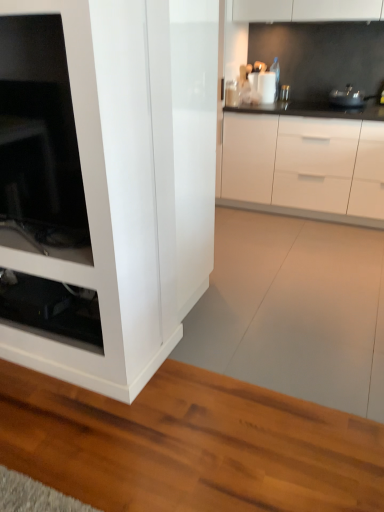
I want to click on white glossy container at upper center, arranged as the 2th appliance when viewed from the right, so click(x=262, y=87).

Where is `transparent glass shelf at lower left`? This screenshot has height=512, width=384. transparent glass shelf at lower left is located at coordinates (51, 309).

You are a GUI agent. You are given a task and a screenshot of the screen. Output one action in this format:
    pyautogui.click(x=<x>, y=<y>)
    Task: Click on the metallic silver pot at upper right, the 1th appliance viewed from the right
    The width and height of the screenshot is (384, 512).
    Given the screenshot: What is the action you would take?
    pyautogui.click(x=348, y=97)

Can you see white glossy container at upper center, arranged as the 2th appliance when viewed from the right, touching white glossy cabinet at center?

No, white glossy container at upper center, arranged as the 2th appliance when viewed from the right, is not touching white glossy cabinet at center.

Considering the relative sizes of white glossy container at upper center, arranged as the 2th appliance when viewed from the right, and white glossy cabinet at center in the image provided, is white glossy container at upper center, arranged as the 2th appliance when viewed from the right, thinner than white glossy cabinet at center?

Indeed, white glossy container at upper center, arranged as the 2th appliance when viewed from the right, has a lesser width compared to white glossy cabinet at center.

From the image's perspective, is white glossy container at upper center, arranged as the 2th appliance when viewed from the right, above white glossy cabinet at center?

Indeed, from the image's perspective, white glossy container at upper center, arranged as the 2th appliance when viewed from the right, is shown above white glossy cabinet at center.

Which is farther, (260, 96) or (310, 213)?

The point (260, 96) is farther.

Would you say metallic silver pot at upper right, the 1th appliance viewed from the right, is outside white glossy cabinet at center?

Yes.

The width and height of the screenshot is (384, 512). In order to click on the 1st appliance directly above the white glossy cabinet at center (from a real-world perspective) in this screenshot , I will do `click(348, 97)`.

Is white glossy cabinet at center at the back of metallic silver pot at upper right, which is the 2th appliance in left-to-right order?

metallic silver pot at upper right, which is the 2th appliance in left-to-right order, does not have its back to white glossy cabinet at center.

Which of these two, metallic silver pot at upper right, the 1th appliance viewed from the right, or white glossy cabinet at center, stands taller?

white glossy cabinet at center is taller.

Is transparent glass shelf at lower left far from white glossy container at upper center, marked as the first appliance in a left-to-right arrangement?

Absolutely, transparent glass shelf at lower left is distant from white glossy container at upper center, marked as the first appliance in a left-to-right arrangement.

In the scene shown: How different are the orientations of transparent glass shelf at lower left and white glossy container at upper center, arranged as the 2th appliance when viewed from the right, in degrees?

1.92 degrees.

Is transparent glass shelf at lower left aimed at white glossy container at upper center, arranged as the 2th appliance when viewed from the right?

No, transparent glass shelf at lower left is not turned towards white glossy container at upper center, arranged as the 2th appliance when viewed from the right.

Who is more distant, transparent glass shelf at lower left or white glossy container at upper center, marked as the first appliance in a left-to-right arrangement?

white glossy container at upper center, marked as the first appliance in a left-to-right arrangement, is further from the camera.

From a real-world perspective, does white glossy cabinet at center sit lower than transparent glass shelf at lower left?

No, from a real-world perspective, white glossy cabinet at center is not under transparent glass shelf at lower left.

Which of these two, white glossy cabinet at center or transparent glass shelf at lower left, is bigger?

white glossy cabinet at center is bigger.

Is white glossy cabinet at center in front of or behind transparent glass shelf at lower left in the image?

white glossy cabinet at center is positioned farther from the viewer than transparent glass shelf at lower left.

Is white glossy cabinet at center not inside transparent glass shelf at lower left?

Yes, white glossy cabinet at center is outside of transparent glass shelf at lower left.

Considering the relative sizes of transparent glass shelf at lower left and metallic silver pot at upper right, the 1th appliance viewed from the right, in the image provided, is transparent glass shelf at lower left wider than metallic silver pot at upper right, the 1th appliance viewed from the right,?

No.

How much distance is there between transparent glass shelf at lower left and metallic silver pot at upper right, the 1th appliance viewed from the right?

The distance of transparent glass shelf at lower left from metallic silver pot at upper right, the 1th appliance viewed from the right, is 2.67 meters.

In the scene shown: From the image's perspective, is transparent glass shelf at lower left beneath metallic silver pot at upper right, the 1th appliance viewed from the right?

Yes, from the image's perspective, transparent glass shelf at lower left is beneath metallic silver pot at upper right, the 1th appliance viewed from the right.

Is point (32, 298) less distant than point (350, 84)?

Yes, point (32, 298) is in front of point (350, 84).

In terms of width, does white glossy container at upper center, marked as the first appliance in a left-to-right arrangement, look wider or thinner when compared to metallic silver pot at upper right, which is the 2th appliance in left-to-right order?

In the image, white glossy container at upper center, marked as the first appliance in a left-to-right arrangement, appears to be more narrow than metallic silver pot at upper right, which is the 2th appliance in left-to-right order.

Consider the image. From the image's perspective, does white glossy container at upper center, marked as the first appliance in a left-to-right arrangement, appear lower than metallic silver pot at upper right, the 1th appliance viewed from the right?

No.

Based on the photo, could metallic silver pot at upper right, the 1th appliance viewed from the right, be considered to be inside white glossy container at upper center, arranged as the 2th appliance when viewed from the right?

That's incorrect, metallic silver pot at upper right, the 1th appliance viewed from the right, is not inside white glossy container at upper center, arranged as the 2th appliance when viewed from the right.

Who is smaller, white glossy cabinet at center or white glossy container at upper center, arranged as the 2th appliance when viewed from the right?

Smaller between the two is white glossy container at upper center, arranged as the 2th appliance when viewed from the right.

Identify the location of cabinetry on the right of white glossy container at upper center, arranged as the 2th appliance when viewed from the right. The width and height of the screenshot is (384, 512). (305, 161).

Is white glossy cabinet at center situated inside white glossy container at upper center, marked as the first appliance in a left-to-right arrangement, or outside?

white glossy cabinet at center is outside white glossy container at upper center, marked as the first appliance in a left-to-right arrangement.

Considering the sizes of objects white glossy cabinet at center and white glossy container at upper center, arranged as the 2th appliance when viewed from the right, in the image provided, who is taller, white glossy cabinet at center or white glossy container at upper center, arranged as the 2th appliance when viewed from the right,?

With more height is white glossy cabinet at center.

This screenshot has width=384, height=512. Identify the location of cabinetry that appears below the white glossy container at upper center, marked as the first appliance in a left-to-right arrangement (from the image's perspective). (305, 161).

Where is `cabinetry beneath the metallic silver pot at upper right, the 1th appliance viewed from the right (from a real-world perspective)`? This screenshot has height=512, width=384. cabinetry beneath the metallic silver pot at upper right, the 1th appliance viewed from the right (from a real-world perspective) is located at coordinates (305, 161).

When comparing their distances from transparent glass shelf at lower left, does metallic silver pot at upper right, which is the 2th appliance in left-to-right order, or white glossy cabinet at center seem further?

metallic silver pot at upper right, which is the 2th appliance in left-to-right order, is positioned further to the anchor transparent glass shelf at lower left.

Which object lies nearer to the anchor point transparent glass shelf at lower left, metallic silver pot at upper right, which is the 2th appliance in left-to-right order, or white glossy container at upper center, arranged as the 2th appliance when viewed from the right?

The object closer to transparent glass shelf at lower left is white glossy container at upper center, arranged as the 2th appliance when viewed from the right.

From the image, which object appears to be farther from white glossy cabinet at center, white glossy container at upper center, arranged as the 2th appliance when viewed from the right, or metallic silver pot at upper right, the 1th appliance viewed from the right?

white glossy container at upper center, arranged as the 2th appliance when viewed from the right, is further to white glossy cabinet at center.

Considering their positions, is white glossy cabinet at center positioned closer to white glossy container at upper center, arranged as the 2th appliance when viewed from the right, than metallic silver pot at upper right, which is the 2th appliance in left-to-right order?

The object closer to white glossy container at upper center, arranged as the 2th appliance when viewed from the right, is metallic silver pot at upper right, which is the 2th appliance in left-to-right order.

From the image, which object appears to be nearer to white glossy cabinet at center, transparent glass shelf at lower left or metallic silver pot at upper right, which is the 2th appliance in left-to-right order?

metallic silver pot at upper right, which is the 2th appliance in left-to-right order, lies closer to white glossy cabinet at center than the other object.

From the image, which object appears to be farther from metallic silver pot at upper right, which is the 2th appliance in left-to-right order, transparent glass shelf at lower left or white glossy container at upper center, arranged as the 2th appliance when viewed from the right?

transparent glass shelf at lower left lies further to metallic silver pot at upper right, which is the 2th appliance in left-to-right order, than the other object.

From the image, which object appears to be farther from transparent glass shelf at lower left, white glossy cabinet at center or metallic silver pot at upper right, the 1th appliance viewed from the right?

The object further to transparent glass shelf at lower left is metallic silver pot at upper right, the 1th appliance viewed from the right.

Which object lies further to the anchor point transparent glass shelf at lower left, white glossy container at upper center, marked as the first appliance in a left-to-right arrangement, or metallic silver pot at upper right, which is the 2th appliance in left-to-right order?

metallic silver pot at upper right, which is the 2th appliance in left-to-right order, is further to transparent glass shelf at lower left.

This screenshot has height=512, width=384. I want to click on appliance located between transparent glass shelf at lower left and white glossy cabinet at center in the left-right direction, so click(x=262, y=87).

At what (x,y) coordinates should I click in order to perform the action: click on cabinetry between transparent glass shelf at lower left and metallic silver pot at upper right, which is the 2th appliance in left-to-right order, in the horizontal direction. Please return your answer as a coordinate pair (x, y). The image size is (384, 512). Looking at the image, I should click on (305, 161).

Locate an element on the screen. This screenshot has height=512, width=384. cabinetry situated between white glossy container at upper center, arranged as the 2th appliance when viewed from the right, and metallic silver pot at upper right, the 1th appliance viewed from the right, from left to right is located at coordinates (305, 161).

Locate an element on the screen. appliance situated between transparent glass shelf at lower left and metallic silver pot at upper right, the 1th appliance viewed from the right, from left to right is located at coordinates (262, 87).